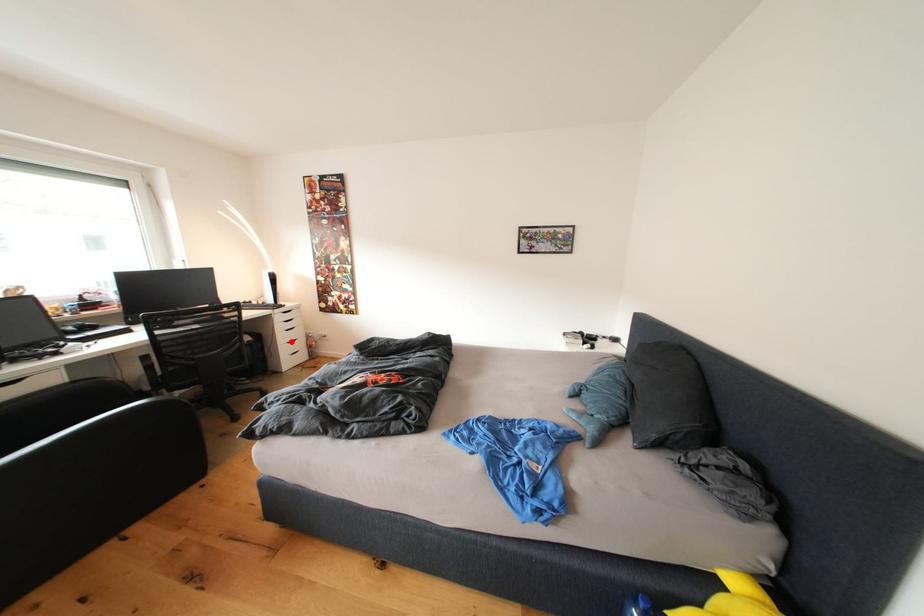
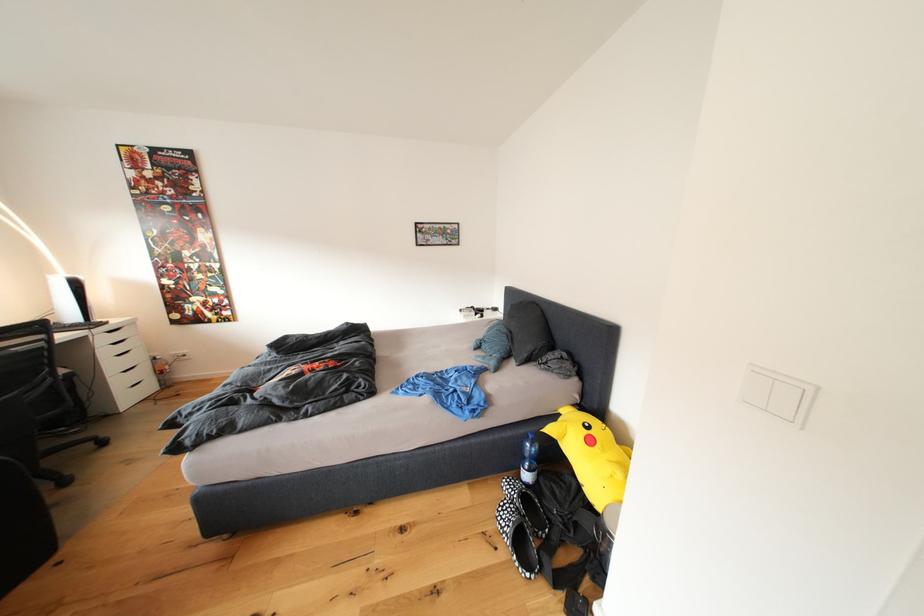
Question: I am providing you with two images of the same scene from different viewpoints. Given a red point in image1, look at the same physical point in image2. Is it:

Choices:
 (A) Closer to the viewpoint
 (B) Farther from the viewpoint

Answer: (B)